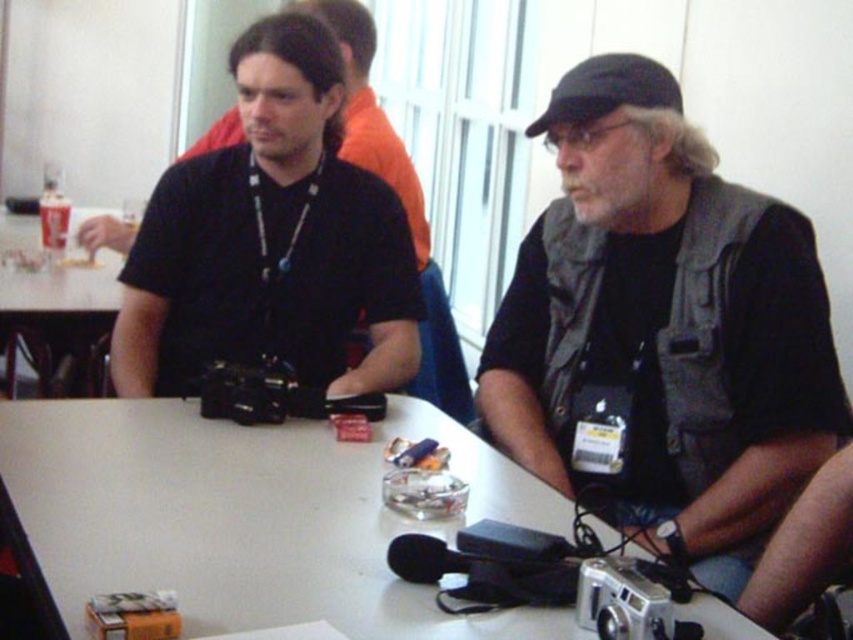
Question: Does gray fabric vest at center have a smaller size compared to matte black camera at left?

Choices:
 (A) no
 (B) yes

Answer: (A)

Question: Is matte black camera at left above silver metallic camera at lower center?

Choices:
 (A) no
 (B) yes

Answer: (B)

Question: Which point is closer to the camera?

Choices:
 (A) silver metallic camera at lower center
 (B) matte black camera at left
 (C) gray fabric vest at center
 (D) white matte table at center

Answer: (D)

Question: Considering the relative positions of gray fabric vest at center and white matte table at center in the image provided, where is gray fabric vest at center located with respect to white matte table at center?

Choices:
 (A) left
 (B) right

Answer: (B)

Question: Which of the following is the closest to the observer?

Choices:
 (A) (641, 634)
 (B) (61, 560)
 (C) (560, 154)
 (D) (265, 250)

Answer: (A)

Question: Which is nearer to the white matte table at center?

Choices:
 (A) silver metallic camera at lower center
 (B) gray fabric vest at center

Answer: (B)